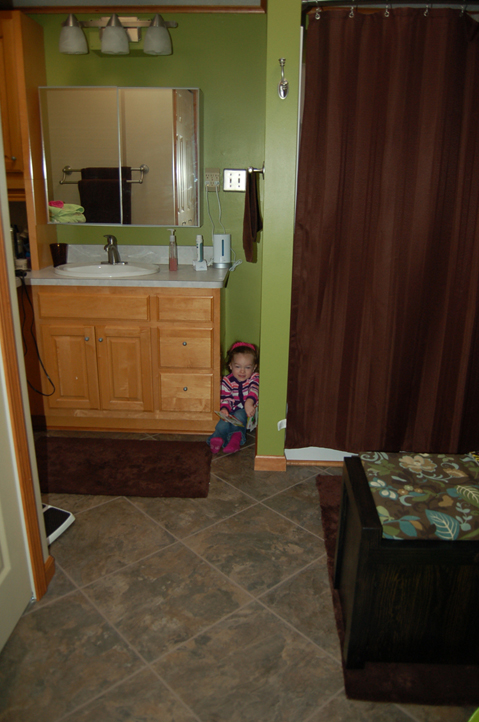
Where is `tile floor`? tile floor is located at coordinates (172, 635).